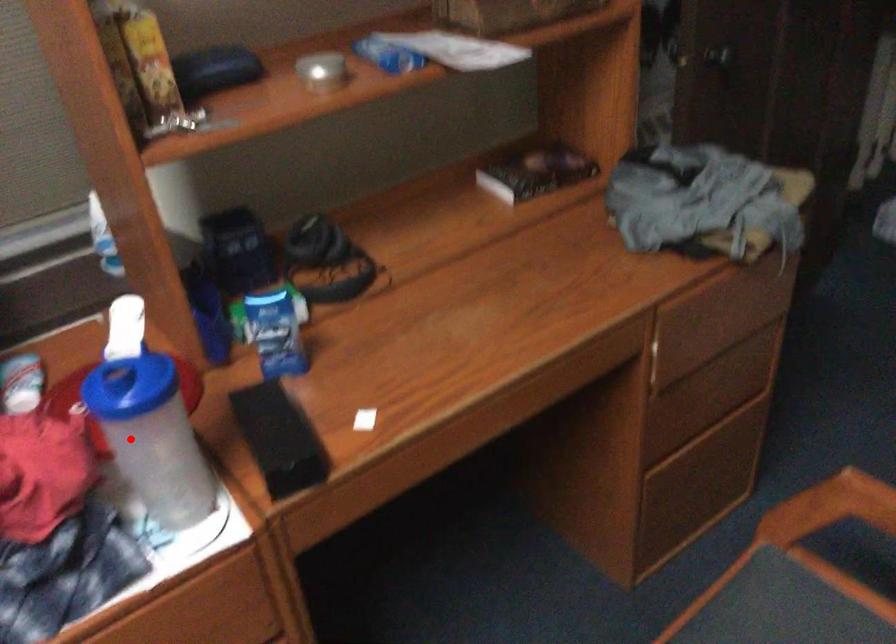
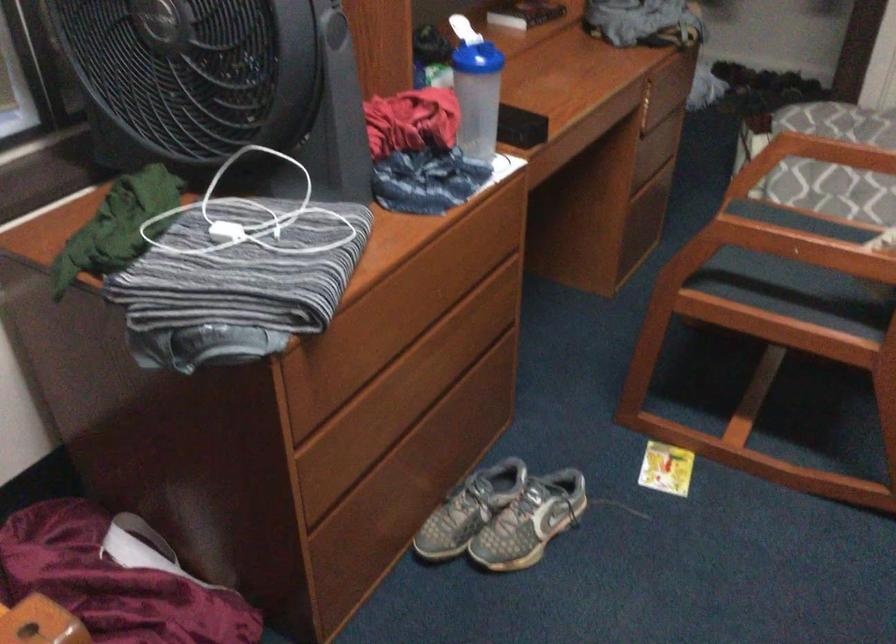
In the second image, find the point that corresponds to the highlighted location in the first image.

(478, 97)